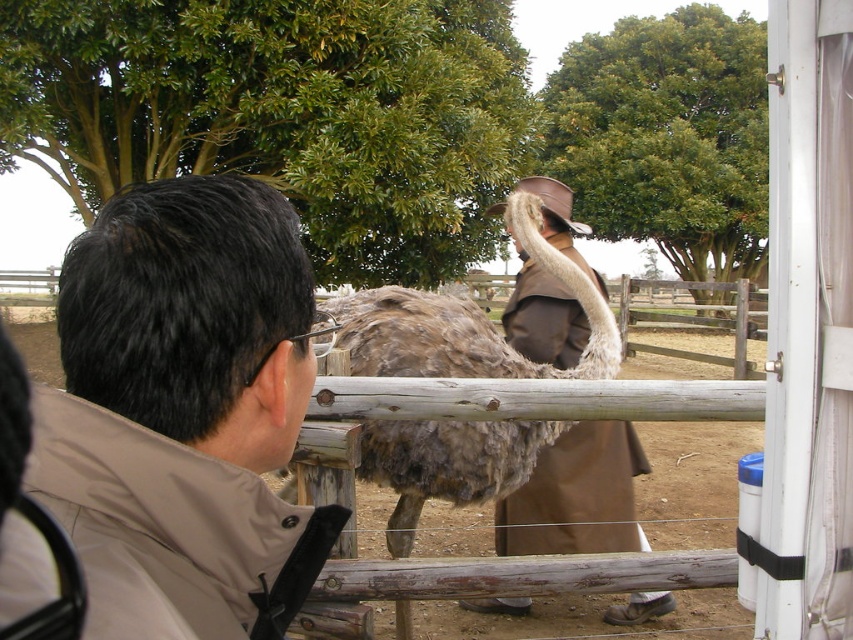
Who is higher up, gray-brown feathered ostrich at center or brown leather trench coat at center?

brown leather trench coat at center is above.

Where is `gray-brown feathered ostrich at center`? This screenshot has height=640, width=853. gray-brown feathered ostrich at center is located at coordinates (466, 323).

Can you confirm if brown matte jacket at upper left is positioned above brown leather trench coat at center?

No, brown matte jacket at upper left is not above brown leather trench coat at center.

Who is more forward, (256,472) or (526,188)?

Positioned in front is point (256,472).

Is point (206, 595) less distant than point (613, 420)?

That is True.

The image size is (853, 640). I want to click on brown matte jacket at upper left, so pyautogui.click(x=183, y=410).

Who is higher up, brown matte jacket at upper left or gray-brown feathered ostrich at center?

gray-brown feathered ostrich at center is above.

Describe the element at coordinates (183, 410) in the screenshot. I see `brown matte jacket at upper left` at that location.

Who is more forward, (67, 353) or (476, 326)?

Point (67, 353) is more forward.

Where is `brown matte jacket at upper left`? The width and height of the screenshot is (853, 640). brown matte jacket at upper left is located at coordinates (183, 410).